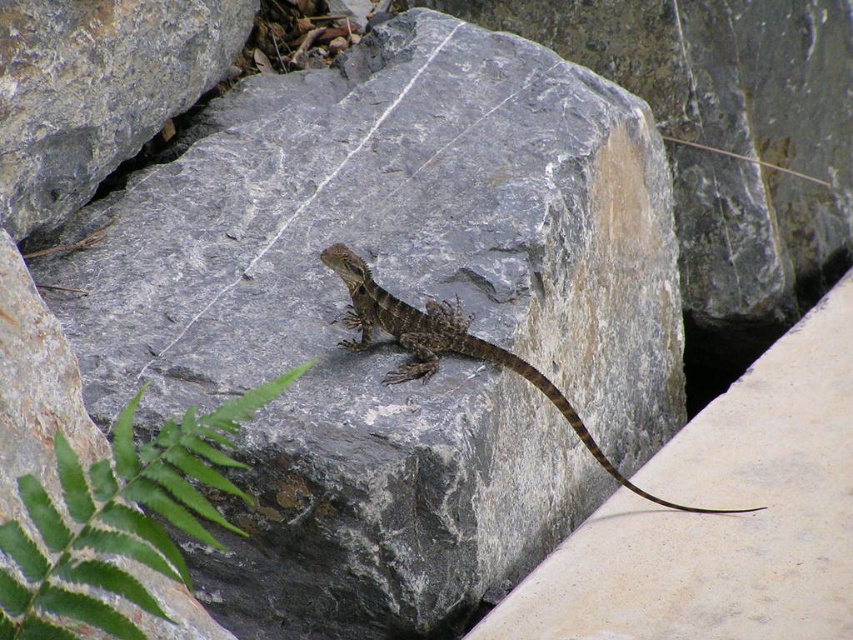
Question: Is smooth concrete ledge at lower right closer to camera compared to gray rough rock at center?

Choices:
 (A) no
 (B) yes

Answer: (B)

Question: Considering the real-world distances, which object is closest to the brown scaly lizard at center?

Choices:
 (A) gray rough rock at center
 (B) green leafy fern at lower left
 (C) brown textured tail at lower right

Answer: (C)

Question: Which point is farther to the camera?

Choices:
 (A) brown textured tail at lower right
 (B) green leafy fern at lower left

Answer: (A)

Question: Which object is positioned closest to the brown textured tail at lower right?

Choices:
 (A) gray rough rock at center
 (B) smooth concrete ledge at lower right
 (C) green leafy fern at lower left
 (D) brown scaly lizard at center

Answer: (D)

Question: Does gray rough rock at center have a larger size compared to brown textured tail at lower right?

Choices:
 (A) no
 (B) yes

Answer: (B)

Question: Can you confirm if smooth concrete ledge at lower right is positioned to the left of green leafy fern at lower left?

Choices:
 (A) no
 (B) yes

Answer: (A)